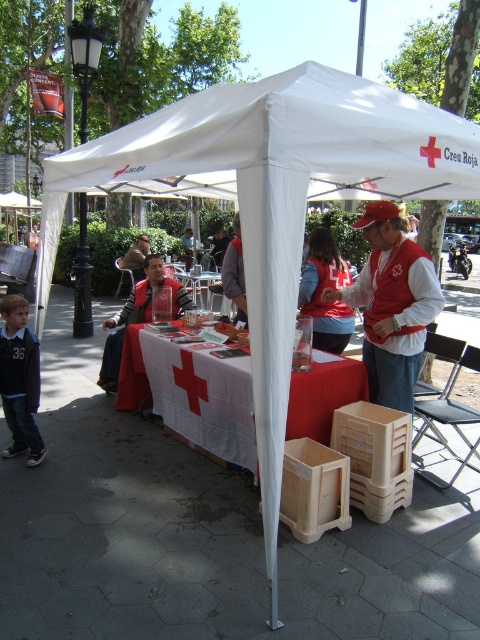
Question: Is red matte vest at center in front of matte brown jacket at center?

Choices:
 (A) yes
 (B) no

Answer: (A)

Question: Which point is closer to the camera?

Choices:
 (A) white fabric tablecloth at center
 (B) dark blue jersey at lower left
 (C) matte red vest at center
 (D) wooden picnic table at center

Answer: (B)

Question: Is red fabric jacket at center wider than matte brown jacket at center?

Choices:
 (A) yes
 (B) no

Answer: (B)

Question: Which is nearer to the red matte vest at center?

Choices:
 (A) white fabric tablecloth at center
 (B) wooden picnic table at center
 (C) matte brown jacket at center
 (D) red fabric jacket at center

Answer: (A)

Question: Which point is closer to the camera taking this photo?

Choices:
 (A) (231, 264)
 (B) (346, 339)
 (C) (136, 352)

Answer: (B)

Question: From the image, what is the correct spatial relationship of dark blue jersey at lower left in relation to matte red vest at center?

Choices:
 (A) right
 (B) left

Answer: (B)